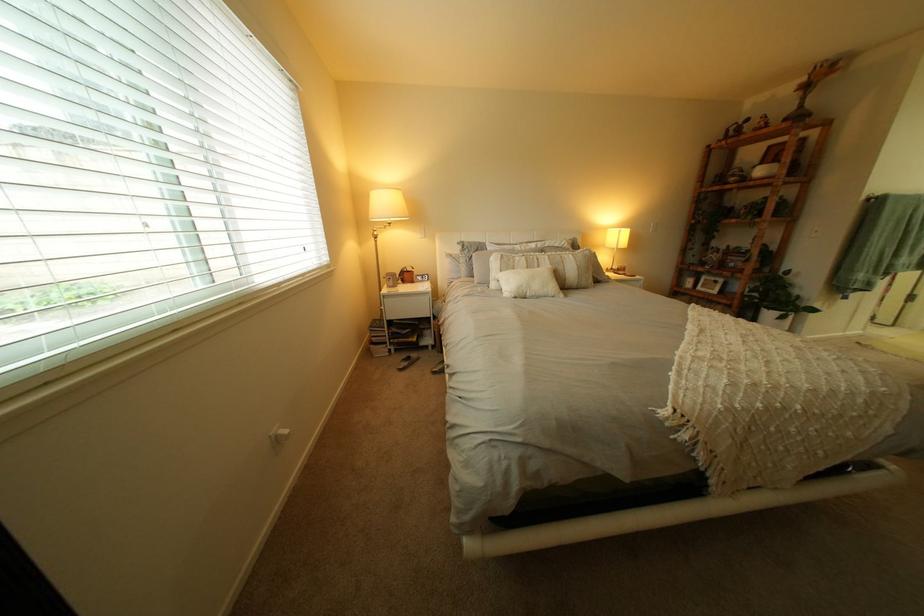
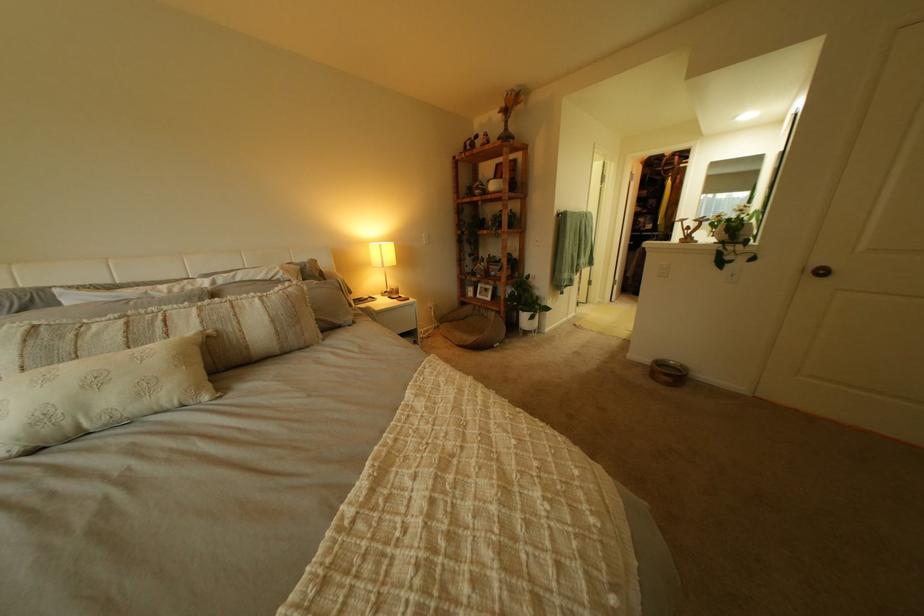
Locate, in the second image, the point that corresponds to (758,172) in the first image.

(497, 185)